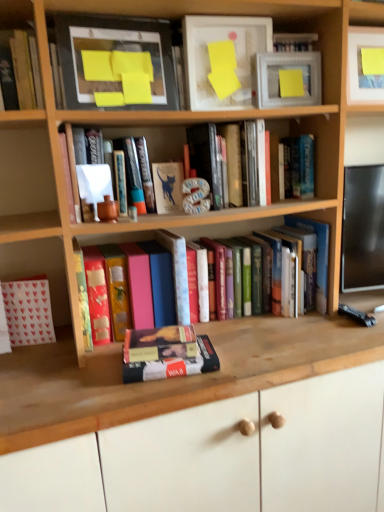
Question: Is hardcover book at upper left, which is the 4th book in right-to-left order, inside wooden at lower center?

Choices:
 (A) no
 (B) yes

Answer: (A)

Question: Is the depth of wooden at lower center greater than that of hardcover book at upper left, which is the 4th book in right-to-left order?

Choices:
 (A) no
 (B) yes

Answer: (A)

Question: Is wooden at lower center not close to hardcover book at upper left, arranged as the second book when viewed from the left?

Choices:
 (A) yes
 (B) no

Answer: (B)

Question: From the image's perspective, is wooden at lower center below hardcover book at upper left, which is the 4th book in right-to-left order?

Choices:
 (A) no
 (B) yes

Answer: (B)

Question: Is hardcover book at upper left, arranged as the second book when viewed from the left, at the back of wooden at lower center?

Choices:
 (A) yes
 (B) no

Answer: (B)

Question: Is wooden at lower center oriented towards hardcover book at upper left, arranged as the second book when viewed from the left?

Choices:
 (A) no
 (B) yes

Answer: (A)

Question: Considering the relative sizes of hardcover book at center, which appears as the 1th paperback book when viewed from the left, and matte white picture frame at upper right, positioned as the 2th picture frame in left-to-right order, in the image provided, is hardcover book at center, which appears as the 1th paperback book when viewed from the left, thinner than matte white picture frame at upper right, positioned as the 2th picture frame in left-to-right order,?

Choices:
 (A) yes
 (B) no

Answer: (B)

Question: From a real-world perspective, is hardcover book at center, the 3th paperback book positioned from the top, on top of matte white picture frame at upper right, which appears as the 1th picture frame when viewed from the right?

Choices:
 (A) no
 (B) yes

Answer: (A)

Question: Considering the relative sizes of hardcover book at center, which appears as the 1th paperback book when viewed from the left, and matte white picture frame at upper right, which appears as the 1th picture frame when viewed from the right, in the image provided, is hardcover book at center, which appears as the 1th paperback book when viewed from the left, wider than matte white picture frame at upper right, which appears as the 1th picture frame when viewed from the right,?

Choices:
 (A) yes
 (B) no

Answer: (A)

Question: Is hardcover book at center, which appears as the 1th paperback book when viewed from the left, positioned before matte white picture frame at upper right, which appears as the 1th picture frame when viewed from the right?

Choices:
 (A) yes
 (B) no

Answer: (A)

Question: Considering the relative positions of hardcover book at center, the 3th paperback book positioned from the top, and matte white picture frame at upper right, which appears as the 1th picture frame when viewed from the right, in the image provided, is hardcover book at center, the 3th paperback book positioned from the top, to the left of matte white picture frame at upper right, which appears as the 1th picture frame when viewed from the right, from the viewer's perspective?

Choices:
 (A) yes
 (B) no

Answer: (A)

Question: Is hardcover book at center, which is counted as the 3th paperback book, starting from the right, bigger than matte white picture frame at upper right, which appears as the 1th picture frame when viewed from the right?

Choices:
 (A) yes
 (B) no

Answer: (A)

Question: From the image's perspective, would you say matte yellow paper at upper center, the 3th paperback book positioned from the left, is shown under matte black picture frame at upper left, the 2th picture frame from the right?

Choices:
 (A) no
 (B) yes

Answer: (A)